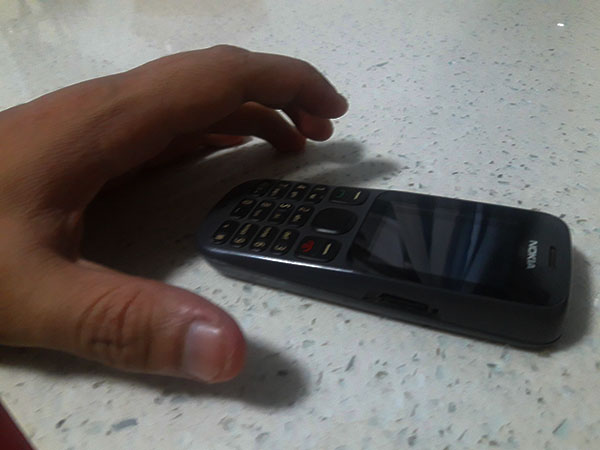
Where is `countertop`? This screenshot has width=600, height=450. countertop is located at coordinates (455, 163).